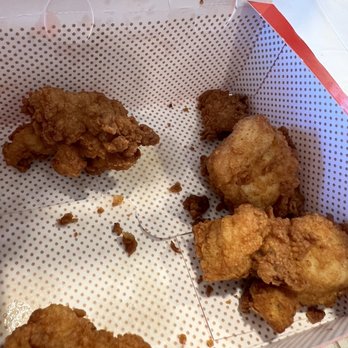
At what (x,y) coordinates should I click in order to perform the action: click on corners. Please return your answer as a coordinate pair (x, y). Looking at the image, I should click on (257, 32), (337, 318).